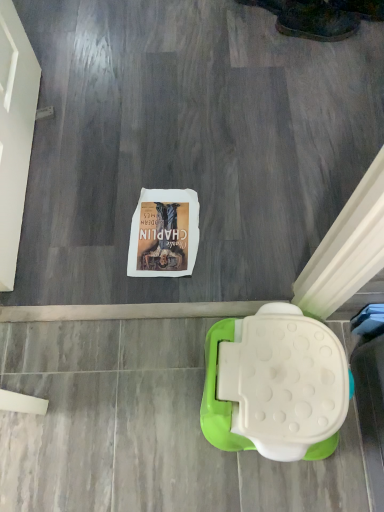
Question: Would you say white plastic toilet at lower right is inside or outside leather boot at upper right?

Choices:
 (A) inside
 (B) outside

Answer: (B)

Question: Considering their positions, is white plastic toilet at lower right located in front of or behind leather boot at upper right?

Choices:
 (A) behind
 (B) front

Answer: (B)

Question: Based on their positions, is white plastic toilet at lower right located to the left or right of leather boot at upper right?

Choices:
 (A) right
 (B) left

Answer: (B)

Question: From their relative heights in the image, would you say leather boot at upper right is taller or shorter than white plastic toilet at lower right?

Choices:
 (A) short
 (B) tall

Answer: (A)

Question: From a real-world perspective, is leather boot at upper right physically located above or below white plastic toilet at lower right?

Choices:
 (A) below
 (B) above

Answer: (A)

Question: Is point (294, 19) closer or farther from the camera than point (276, 395)?

Choices:
 (A) farther
 (B) closer

Answer: (A)

Question: From the image's perspective, is leather boot at upper right positioned above or below white plastic toilet at lower right?

Choices:
 (A) below
 (B) above

Answer: (B)